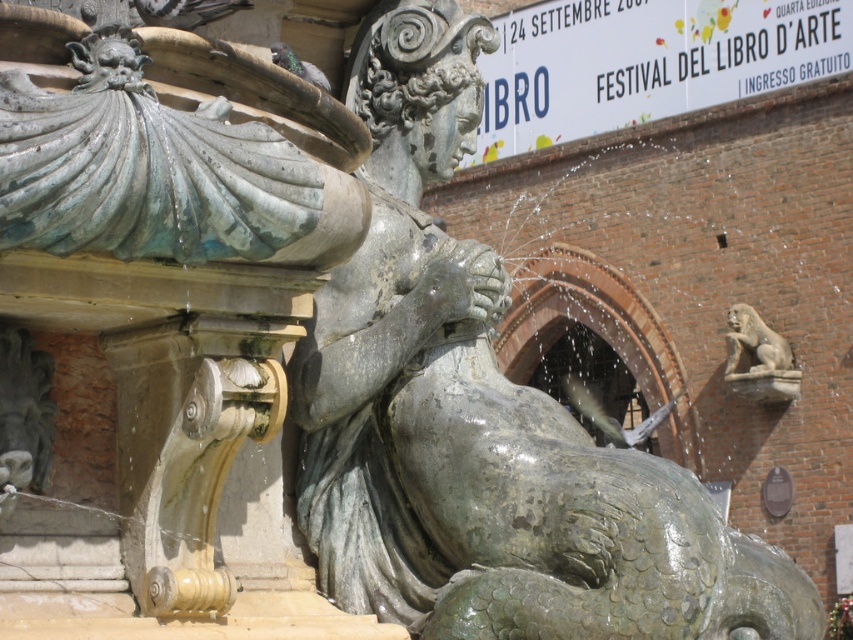
Question: Which of the following is the farthest from the observer?

Choices:
 (A) (775, 348)
 (B) (144, 17)
 (C) (283, 52)

Answer: (A)

Question: Does gray feathered pigeon at upper left appear over gray matte pigeon at upper left?

Choices:
 (A) yes
 (B) no

Answer: (A)

Question: Does gray stone lion at upper right have a lesser width compared to gray feathered pigeon at upper left?

Choices:
 (A) yes
 (B) no

Answer: (B)

Question: Which of these objects is positioned closest to the gray stone lion at upper right?

Choices:
 (A) gray feathered pigeon at upper left
 (B) gray matte pigeon at upper left

Answer: (B)

Question: Which of the following is the closest to the observer?

Choices:
 (A) gray stone lion at upper right
 (B) gray feathered pigeon at upper left

Answer: (B)

Question: Can you confirm if gray stone lion at upper right is positioned to the left of gray feathered pigeon at upper left?

Choices:
 (A) yes
 (B) no

Answer: (B)